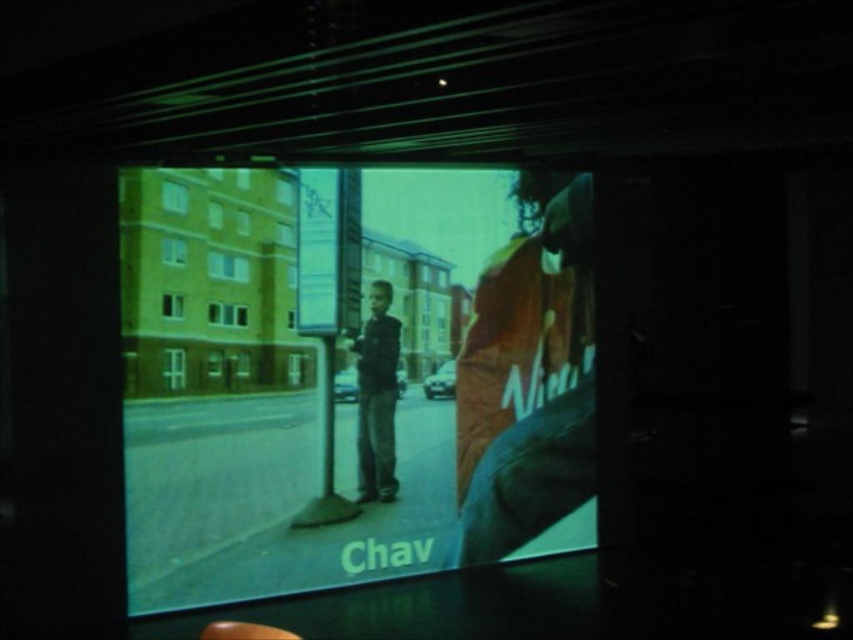
You are a film director reviewing a scene where a young boy stands on a sidewalk. The scene is displayed on a matte plastic screen at center and you notice dark blue jeans at center. Which object is located to the right of the other?

The matte plastic screen at center is positioned on the right side of dark blue jeans at center.

You are a film editor reviewing this scene. You need to determine which of the two points, point (218,536) or point (589,413), is in front in the 3D space. Based on the scene description, which point is closer to the camera?

Point (218,536) is closer to the camera than point (589,413).